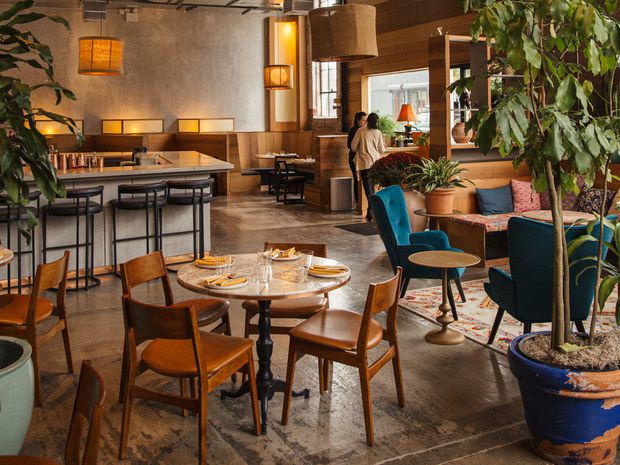
This screenshot has height=465, width=620. What are the coordinates of `lamp shades` in the screenshot? It's located at (95, 50), (53, 125), (126, 123), (211, 127), (278, 77), (351, 33), (405, 107), (278, 45).